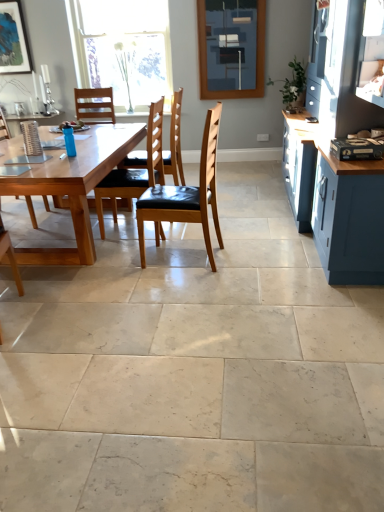
Question: Is matte blue cabinet at right not within clear glass window at upper center?

Choices:
 (A) no
 (B) yes

Answer: (B)

Question: Are matte blue cabinet at right and clear glass window at upper center beside each other?

Choices:
 (A) no
 (B) yes

Answer: (A)

Question: Is clear glass window at upper center surrounded by matte blue cabinet at right?

Choices:
 (A) no
 (B) yes

Answer: (A)

Question: Can you confirm if matte blue cabinet at right is wider than clear glass window at upper center?

Choices:
 (A) yes
 (B) no

Answer: (A)

Question: Does matte blue cabinet at right come behind clear glass window at upper center?

Choices:
 (A) yes
 (B) no

Answer: (B)

Question: In the image, is clear glass window at upper center on the left side or the right side of brown leather chair at center, the first chair from the right?

Choices:
 (A) left
 (B) right

Answer: (A)

Question: From the image's perspective, is clear glass window at upper center above or below brown leather chair at center, placed as the fourth chair when sorted from left to right?

Choices:
 (A) below
 (B) above

Answer: (B)

Question: Is clear glass window at upper center taller or shorter than brown leather chair at center, placed as the fourth chair when sorted from left to right?

Choices:
 (A) short
 (B) tall

Answer: (B)

Question: Choose the correct answer: Is clear glass window at upper center inside brown leather chair at center, placed as the fourth chair when sorted from left to right, or outside it?

Choices:
 (A) inside
 (B) outside

Answer: (B)

Question: Is matte black picture frame at upper left to the left or to the right of wooden chair at center, marked as the third chair in a right-to-left arrangement, in the image?

Choices:
 (A) left
 (B) right

Answer: (A)

Question: From the image's perspective, is matte black picture frame at upper left located above or below wooden chair at center, acting as the second chair starting from the left?

Choices:
 (A) below
 (B) above

Answer: (B)

Question: Considering the positions of point click(x=8, y=67) and point click(x=158, y=177), is point click(x=8, y=67) closer or farther from the camera than point click(x=158, y=177)?

Choices:
 (A) closer
 (B) farther

Answer: (B)

Question: From a real-world perspective, relative to wooden chair at center, acting as the second chair starting from the left, is matte black picture frame at upper left vertically above or below?

Choices:
 (A) below
 (B) above

Answer: (B)

Question: Which is correct: natural wood table at center is inside wooden chair at left, arranged as the fourth chair when viewed from the right, or outside of it?

Choices:
 (A) inside
 (B) outside

Answer: (B)

Question: Considering the positions of natural wood table at center and wooden chair at left, arranged as the fourth chair when viewed from the right, in the image, is natural wood table at center bigger or smaller than wooden chair at left, arranged as the fourth chair when viewed from the right,?

Choices:
 (A) big
 (B) small

Answer: (A)